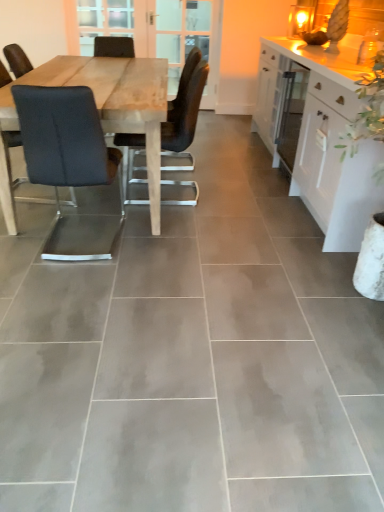
Question: Is clear glass screen door at upper center, which is counted as the first screen door, starting from the right, further to camera compared to black fabric chair at left, positioned as the second chair in right-to-left order?

Choices:
 (A) yes
 (B) no

Answer: (A)

Question: From the image's perspective, does clear glass screen door at upper center, placed as the 2th screen door when sorted from left to right, appear lower than black fabric chair at left, which is the first chair from left to right?

Choices:
 (A) no
 (B) yes

Answer: (A)

Question: Are clear glass screen door at upper center, which is counted as the first screen door, starting from the right, and black fabric chair at left, positioned as the second chair in right-to-left order, beside each other?

Choices:
 (A) yes
 (B) no

Answer: (B)

Question: From a real-world perspective, is clear glass screen door at upper center, placed as the 2th screen door when sorted from left to right, physically above black fabric chair at left, positioned as the second chair in right-to-left order?

Choices:
 (A) no
 (B) yes

Answer: (B)

Question: Can we say clear glass screen door at upper center, which is counted as the first screen door, starting from the right, lies outside black fabric chair at left, positioned as the second chair in right-to-left order?

Choices:
 (A) yes
 (B) no

Answer: (A)

Question: In terms of size, does white glossy cabinet at right appear bigger or smaller than matte black chair at center, which appears as the second chair when viewed from the left?

Choices:
 (A) big
 (B) small

Answer: (A)

Question: Does point (299, 42) appear closer or farther from the camera than point (183, 102)?

Choices:
 (A) closer
 (B) farther

Answer: (B)

Question: Considering their positions, is white glossy cabinet at right located in front of or behind matte black chair at center, which appears as the second chair when viewed from the left?

Choices:
 (A) behind
 (B) front

Answer: (B)

Question: Is white glossy cabinet at right taller or shorter than matte black chair at center, which appears as the second chair when viewed from the left?

Choices:
 (A) short
 (B) tall

Answer: (B)

Question: From the image's perspective, is clear glass screen door at upper center, which is counted as the first screen door, starting from the right, positioned above or below wooden screen door at center, the first screen door when ordered from left to right?

Choices:
 (A) below
 (B) above

Answer: (A)

Question: In the image, is clear glass screen door at upper center, placed as the 2th screen door when sorted from left to right, positioned in front of or behind wooden screen door at center, the first screen door when ordered from left to right?

Choices:
 (A) front
 (B) behind

Answer: (B)

Question: In terms of size, does clear glass screen door at upper center, placed as the 2th screen door when sorted from left to right, appear bigger or smaller than wooden screen door at center, which is counted as the 2th screen door, starting from the right?

Choices:
 (A) big
 (B) small

Answer: (B)

Question: From a real-world perspective, is clear glass screen door at upper center, placed as the 2th screen door when sorted from left to right, positioned above or below wooden screen door at center, which is counted as the 2th screen door, starting from the right?

Choices:
 (A) above
 (B) below

Answer: (A)

Question: Choose the correct answer: Is black fabric chair at left, which is the first chair from left to right, inside wooden screen door at center, which is counted as the 2th screen door, starting from the right, or outside it?

Choices:
 (A) inside
 (B) outside

Answer: (B)

Question: In terms of height, does black fabric chair at left, which is the first chair from left to right, look taller or shorter compared to wooden screen door at center, which is counted as the 2th screen door, starting from the right?

Choices:
 (A) tall
 (B) short

Answer: (B)